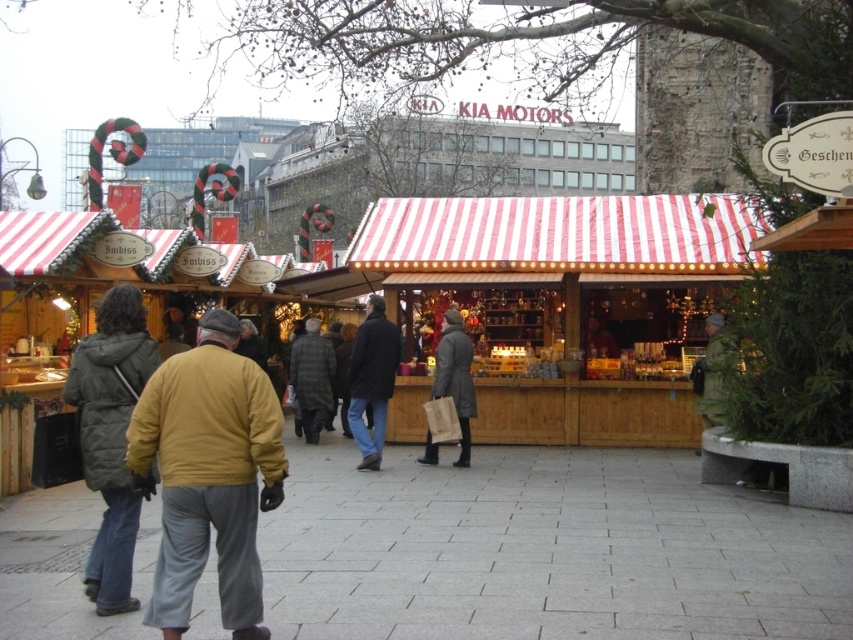
Question: Does yellow fabric jacket at center have a lesser width compared to dark green puffer jacket at left?

Choices:
 (A) no
 (B) yes

Answer: (A)

Question: Which of the following is the closest to the observer?

Choices:
 (A) dark brown leather jacket at center
 (B) yellow fabric jacket at center
 (C) matte yellow jacket at center
 (D) dark blue jeans at center

Answer: (B)

Question: Which object is closer to the camera taking this photo?

Choices:
 (A) matte yellow jacket at center
 (B) yellow fabric jacket at center

Answer: (B)

Question: Is dark green puffer jacket at left thinner than plaid fabric jacket at center?

Choices:
 (A) no
 (B) yes

Answer: (A)

Question: Estimate the real-world distances between objects in this image. Which object is closer to the dark gray coat at center?

Choices:
 (A) plaid fabric jacket at center
 (B) dark brown leather jacket at center
 (C) matte gray jacket at center

Answer: (C)

Question: Can you confirm if dark green puffer jacket at left is wider than matte gray jacket at center?

Choices:
 (A) no
 (B) yes

Answer: (B)